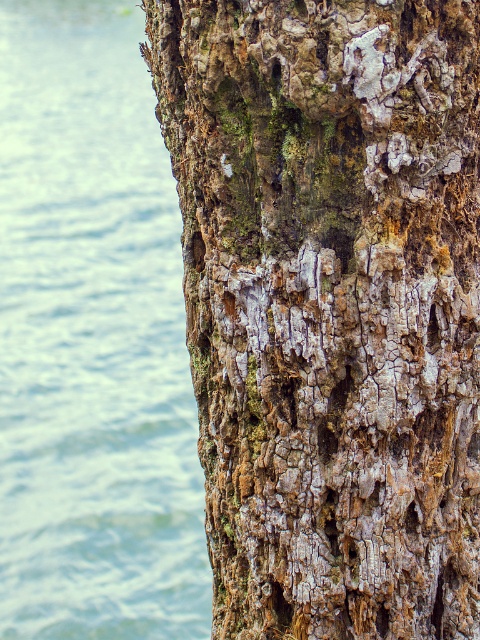
You are standing in front of a tree trunk and want to take a photo of both the cracked bark tree trunk at right and the blue water at left. Which object should you focus on first to ensure both are in focus?

You should focus on the cracked bark tree trunk at right first because it is closer to the viewer than the blue water at left, so adjusting focus starting from the closer object ensures the background will also be in focus.

You are a photographer standing in front of the cracked bark tree trunk at right and the blue water at left. You want to capture a photo where both objects are visible. Which object should you position closer to the center of the frame to ensure both are fully visible?

The cracked bark tree trunk at right is not as tall as the blue water at left, so positioning the blue water at left closer to the center of the frame would allow both objects to be fully visible in the photo.